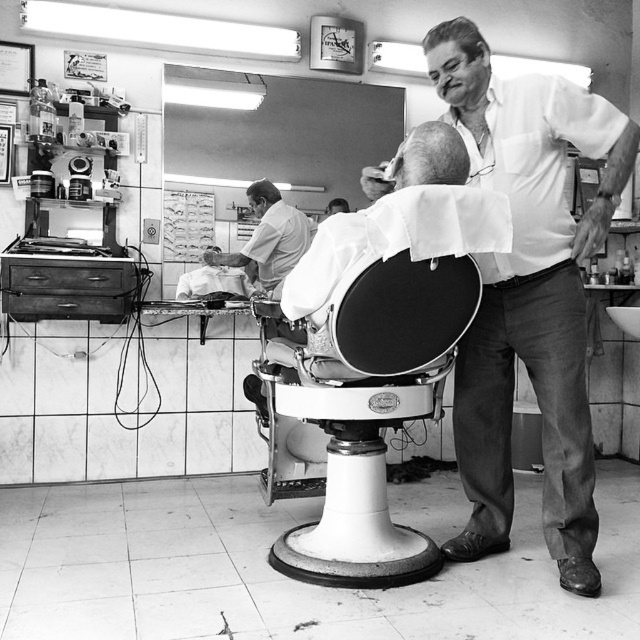
Is smooth skin man at center closer to the viewer compared to dark brown hair at upper center?

Yes, it is in front of dark brown hair at upper center.

In the scene shown: Which of these two, smooth skin man at center or dark brown hair at upper center, stands taller?

smooth skin man at center is taller.

This screenshot has height=640, width=640. In order to click on smooth skin man at center in this screenshot , I will do coord(268,237).

This screenshot has width=640, height=640. I want to click on smooth skin man at center, so click(x=268, y=237).

Does smooth skin man at center appear under gray matte hair at center?

Indeed, smooth skin man at center is positioned under gray matte hair at center.

Does smooth skin man at center have a greater width compared to gray matte hair at center?

Yes.

Is point (253, 236) closer to camera compared to point (429, 129)?

No, (253, 236) is behind (429, 129).

Where is `smooth skin man at center`? The width and height of the screenshot is (640, 640). smooth skin man at center is located at coordinates (268, 237).

At what (x,y) coordinates should I click in order to perform the action: click on white cotton shirt at upper right. Please return your answer as a coordinate pair (x, y). Looking at the image, I should click on (531, 301).

Does white cotton shirt at upper right appear over smooth skin man at center?

Incorrect, white cotton shirt at upper right is not positioned above smooth skin man at center.

Where is `white cotton shirt at upper right`? This screenshot has height=640, width=640. white cotton shirt at upper right is located at coordinates (531, 301).